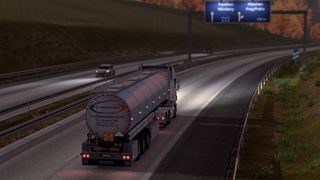
Image resolution: width=320 pixels, height=180 pixels. I want to click on lights, so click(x=128, y=155), click(x=124, y=156), click(x=88, y=156), click(x=83, y=155), click(x=163, y=117), click(x=153, y=118), click(x=107, y=70), click(x=95, y=71).